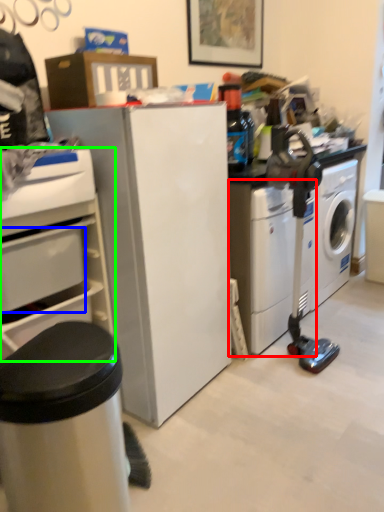
Question: Which object is the closest to the washing machine (highlighted by a red box)? Choose among these: drawer (highlighted by a blue box) or home appliance (highlighted by a green box).

Choices:
 (A) drawer
 (B) home appliance

Answer: (B)